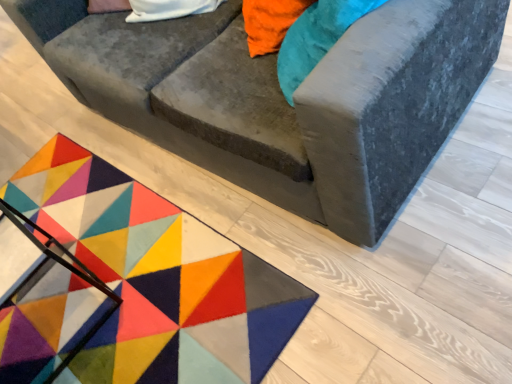
Question: Could velvet gray couch at center be considered to be inside multicolored felt mat at lower left?

Choices:
 (A) no
 (B) yes

Answer: (A)

Question: Does multicolored felt mat at lower left have a lesser height compared to velvet gray couch at center?

Choices:
 (A) no
 (B) yes

Answer: (B)

Question: From a real-world perspective, is multicolored felt mat at lower left physically below velvet gray couch at center?

Choices:
 (A) no
 (B) yes

Answer: (B)

Question: Considering the relative sizes of multicolored felt mat at lower left and velvet gray couch at center in the image provided, is multicolored felt mat at lower left wider than velvet gray couch at center?

Choices:
 (A) no
 (B) yes

Answer: (A)

Question: Are multicolored felt mat at lower left and velvet gray couch at center far apart?

Choices:
 (A) no
 (B) yes

Answer: (A)

Question: From the image's perspective, is multicolored felt mat at lower left below velvet gray couch at center?

Choices:
 (A) yes
 (B) no

Answer: (A)

Question: Is multicolored felt mat at lower left surrounded by velvet gray couch at center?

Choices:
 (A) no
 (B) yes

Answer: (A)

Question: Is velvet gray couch at center to the right of multicolored felt mat at lower left from the viewer's perspective?

Choices:
 (A) no
 (B) yes

Answer: (B)

Question: Is velvet gray couch at center bigger than multicolored felt mat at lower left?

Choices:
 (A) no
 (B) yes

Answer: (B)

Question: Is velvet gray couch at center at the left side of multicolored felt mat at lower left?

Choices:
 (A) yes
 (B) no

Answer: (B)

Question: Can you confirm if velvet gray couch at center is taller than multicolored felt mat at lower left?

Choices:
 (A) no
 (B) yes

Answer: (B)

Question: From the image's perspective, is velvet gray couch at center above multicolored felt mat at lower left?

Choices:
 (A) no
 (B) yes

Answer: (B)

Question: From the image's perspective, is multicolored felt mat at lower left above or below velvet gray couch at center?

Choices:
 (A) below
 (B) above

Answer: (A)